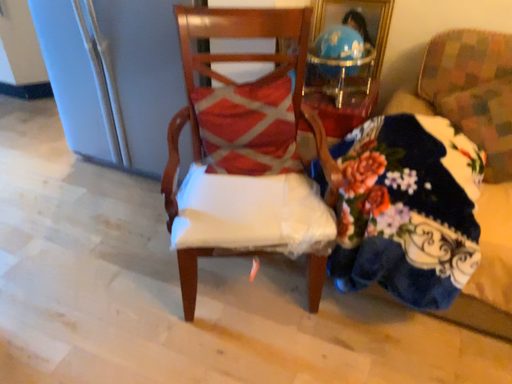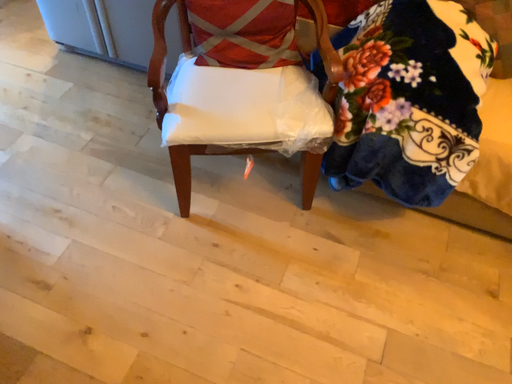
Question: How did the camera likely rotate when shooting the video?

Choices:
 (A) rotated upward
 (B) rotated downward

Answer: (B)